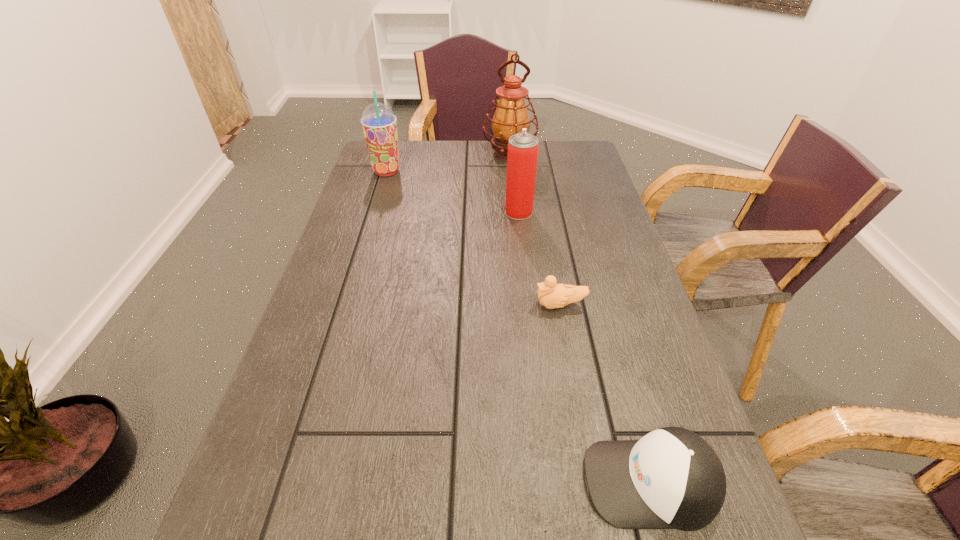
At what (x,y) coordinates should I click in order to perform the action: click on vacant space that's between the smoothie and the shortest object. Please return your answer as a coordinate pair (x, y). The height and width of the screenshot is (540, 960). Looking at the image, I should click on (473, 238).

Identify the location of blank region between the fourth tallest object and the leftmost object. This screenshot has height=540, width=960. (518, 327).

Where is `vacant area that lies between the tallest object and the smoothie`? vacant area that lies between the tallest object and the smoothie is located at coordinates (448, 163).

Locate an element on the screen. vacant area that lies between the leftmost object and the third nearest object is located at coordinates (453, 192).

Where is `free point between the aerosol can and the shortest object`? free point between the aerosol can and the shortest object is located at coordinates (540, 259).

Select which object is the second closest to the duckling. Please provide its 2D coordinates. Your answer should be formatted as a tuple, i.e. [(x, y)], where the tuple contains the x and y coordinates of a point satisfying the conditions above.

[(523, 147)]

Identify which object is the third closest to the nearest object. Please provide its 2D coordinates. Your answer should be formatted as a tuple, i.e. [(x, y)], where the tuple contains the x and y coordinates of a point satisfying the conditions above.

[(511, 115)]

At what (x,y) coordinates should I click in order to perform the action: click on free spot that satisfies the following two spatial constraints: 1. on the front side of the tallest object; 2. on the left side of the third nearest object. Please return your answer as a coordinate pair (x, y). Looking at the image, I should click on (516, 212).